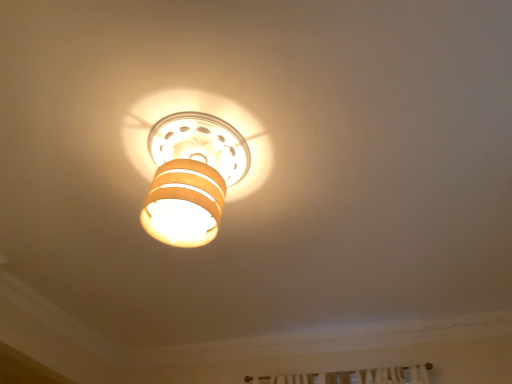
Measure the distance between point (228, 105) and camera.

1.98 meters.

You are a GUI agent. You are given a task and a screenshot of the screen. Output one action in this format:
    pyautogui.click(x=<x>, y=<y>)
    Task: Click on the matte gold lampshade at center
    The height and width of the screenshot is (384, 512).
    Given the screenshot: What is the action you would take?
    pyautogui.click(x=194, y=161)

The height and width of the screenshot is (384, 512). Describe the element at coordinates (194, 161) in the screenshot. I see `matte gold lampshade at center` at that location.

At what (x,y) coordinates should I click in order to perform the action: click on matte gold lampshade at center. Please return your answer as a coordinate pair (x, y). Looking at the image, I should click on tap(194, 161).